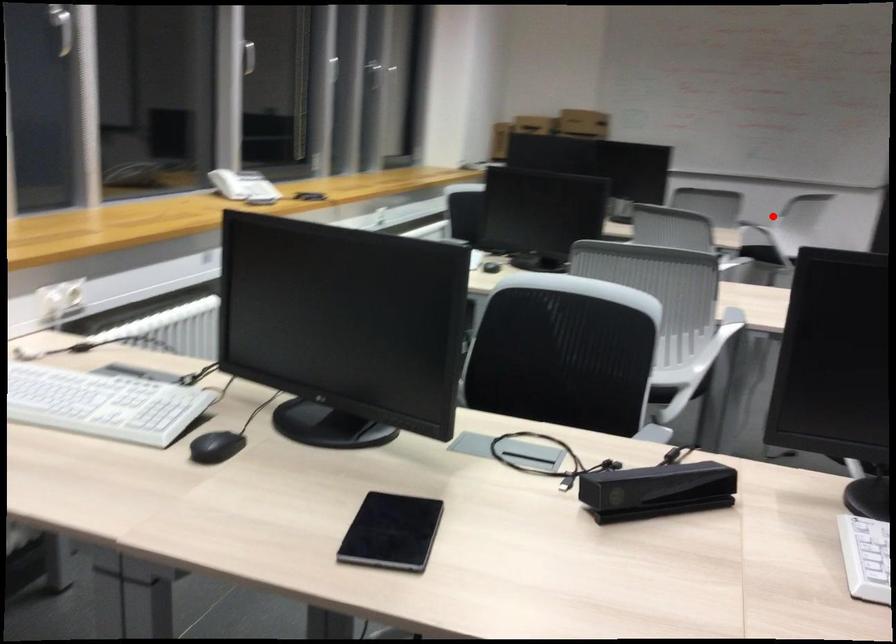
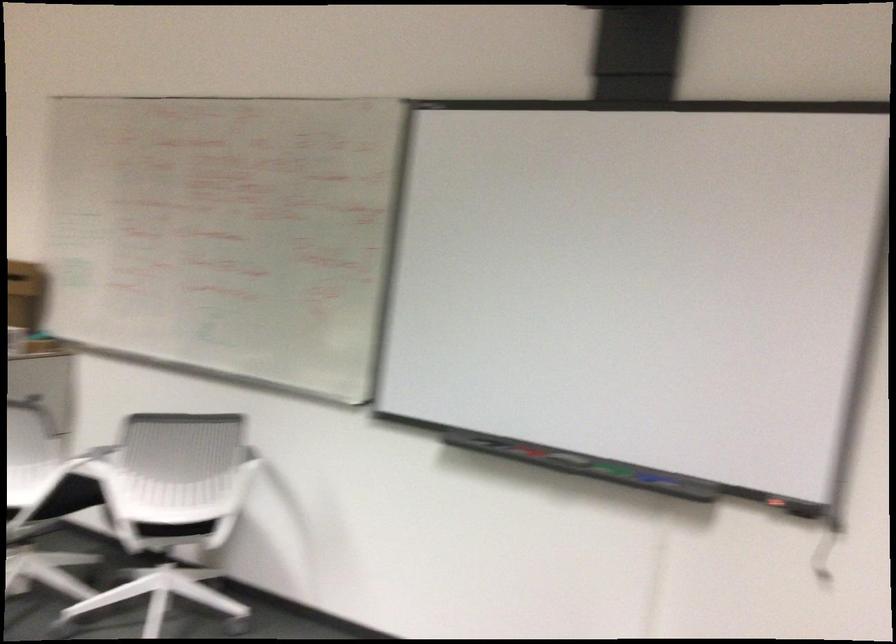
Question: I am providing you with two images of the same scene from different viewpoints. Given a red point in image1, look at the same physical point in image2. Is it:

Choices:
 (A) Closer to the viewpoint
 (B) Farther from the viewpoint

Answer: (A)